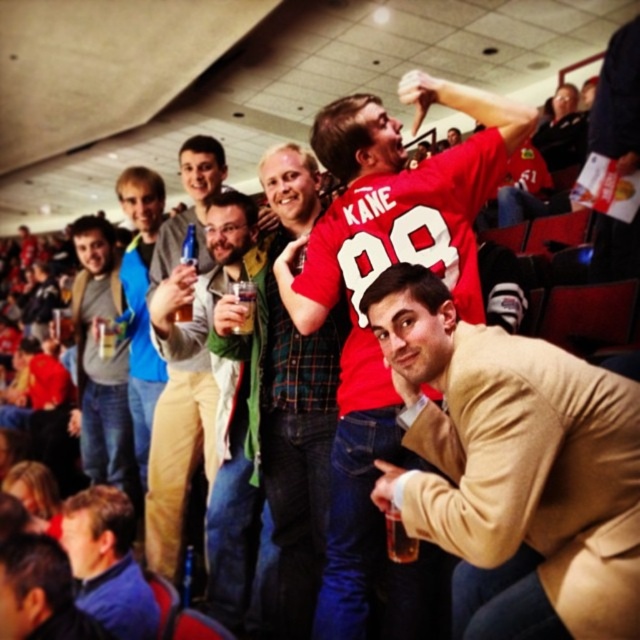
Question: Which object is closer to the camera taking this photo?

Choices:
 (A) blue fabric jacket at lower left
 (B) translucent plastic bottle at center

Answer: (A)

Question: Which of the following is the closest to the observer?

Choices:
 (A) (289, 545)
 (B) (202, 141)

Answer: (A)

Question: Is red jersey at center below translucent plastic cup at lower center?

Choices:
 (A) no
 (B) yes

Answer: (A)

Question: Is green plaid shirt at center smaller than translucent plastic cup at lower center?

Choices:
 (A) yes
 (B) no

Answer: (B)

Question: From the image, what is the correct spatial relationship of blue fabric jacket at center in relation to translucent plastic cup at lower center?

Choices:
 (A) right
 (B) left

Answer: (B)

Question: Which of the following is the farthest from the observer?

Choices:
 (A) clear plastic cup at center
 (B) matte gray hoodie at center
 (C) translucent plastic cup at lower center
 (D) green plaid shirt at center

Answer: (B)